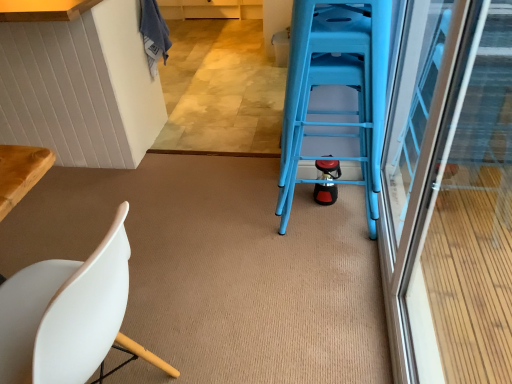
Question: Based on their sizes in the image, would you say white matte chair at lower left is bigger or smaller than transparent glass screen door at right?

Choices:
 (A) big
 (B) small

Answer: (B)

Question: In the image, is white matte chair at lower left positioned in front of or behind transparent glass screen door at right?

Choices:
 (A) behind
 (B) front

Answer: (A)

Question: Which object is the farthest from the blue plastic ladder at center?

Choices:
 (A) white matte chair at lower left
 (B) transparent glass screen door at right

Answer: (A)

Question: Estimate the real-world distances between objects in this image. Which object is closer to the white matte chair at lower left?

Choices:
 (A) blue plastic ladder at center
 (B) transparent glass screen door at right

Answer: (A)